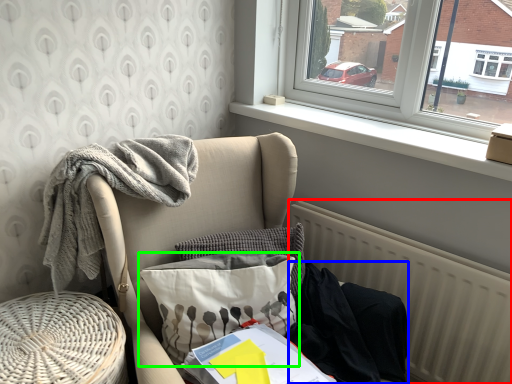
Question: Which object is positioned closest to radiator (highlighted by a red box)? Select from clothing (highlighted by a blue box) and pillow (highlighted by a green box).

Choices:
 (A) clothing
 (B) pillow

Answer: (A)